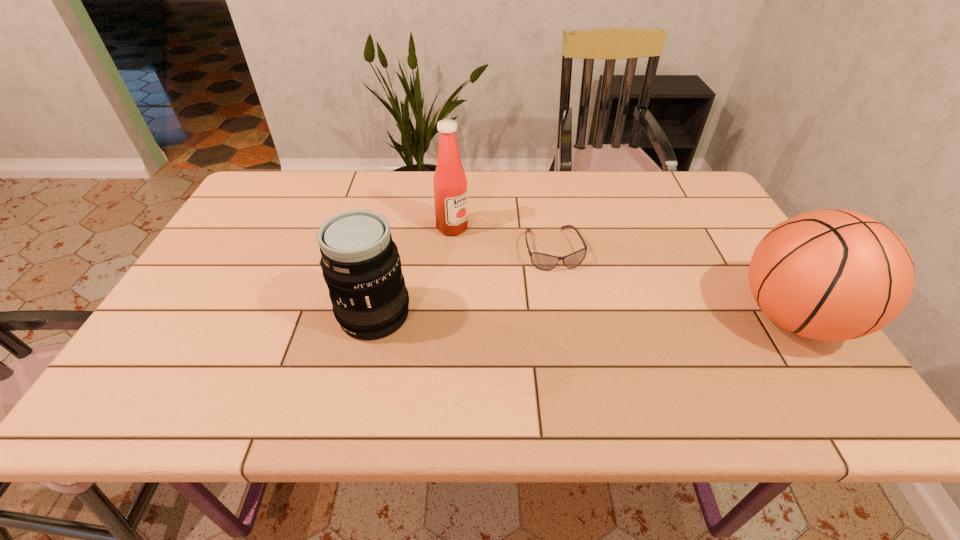
Locate an element on the screen. This screenshot has width=960, height=540. telephoto lens is located at coordinates (361, 266).

Identify the location of basketball. (832, 275).

Where is `the third object from right to left`? The width and height of the screenshot is (960, 540). the third object from right to left is located at coordinates (450, 184).

Find the location of a particular element. The image size is (960, 540). the second object from right to left is located at coordinates (545, 262).

The image size is (960, 540). What are the coordinates of `sunglasses` in the screenshot? It's located at (545, 262).

Image resolution: width=960 pixels, height=540 pixels. I want to click on free spot located 0.210m on the back of the telephoto lens, so click(393, 236).

Where is `vacant area situated on the back of the rightmost object`? Image resolution: width=960 pixels, height=540 pixels. vacant area situated on the back of the rightmost object is located at coordinates (744, 245).

The height and width of the screenshot is (540, 960). Find the location of `free space located 0.310m on the front-facing side of the condiment`. free space located 0.310m on the front-facing side of the condiment is located at coordinates (542, 295).

Where is `blank space located 0.330m on the front-facing side of the condiment`? This screenshot has height=540, width=960. blank space located 0.330m on the front-facing side of the condiment is located at coordinates (548, 299).

The height and width of the screenshot is (540, 960). In order to click on vacant area situated 0.310m on the front-facing side of the condiment in this screenshot , I will do `click(542, 295)`.